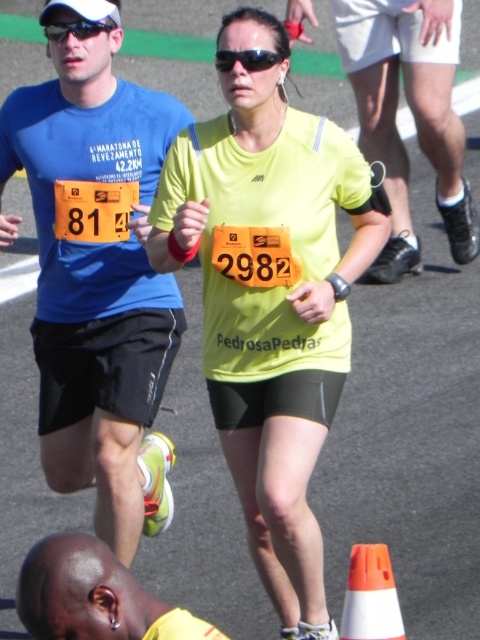
You are a photographer standing at the camera position. You want to take a photo of the point at coordinates (180, 305). If your camera has a focal length of 50mm and you are 16.30 feet away from the point, what is the approximate angle of view needed to capture the point in the center of the frame?

The point at coordinates (180, 305) is 16.30 feet away from the camera. To center it in the frame with a 50mm focal length, the angle of view would be approximately 27 degrees, calculated using the formula angle of view formula.